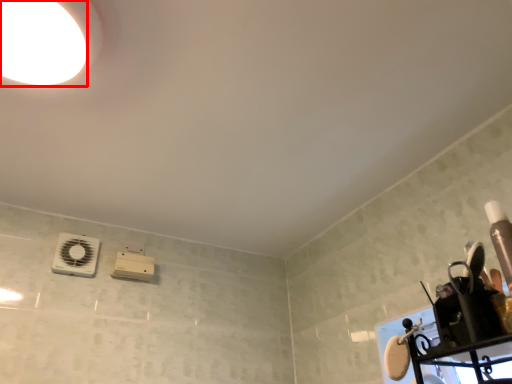
Question: From the image's perspective, where is droplight (annotated by the red box) located in relation to appliance in the image?

Choices:
 (A) above
 (B) below

Answer: (A)